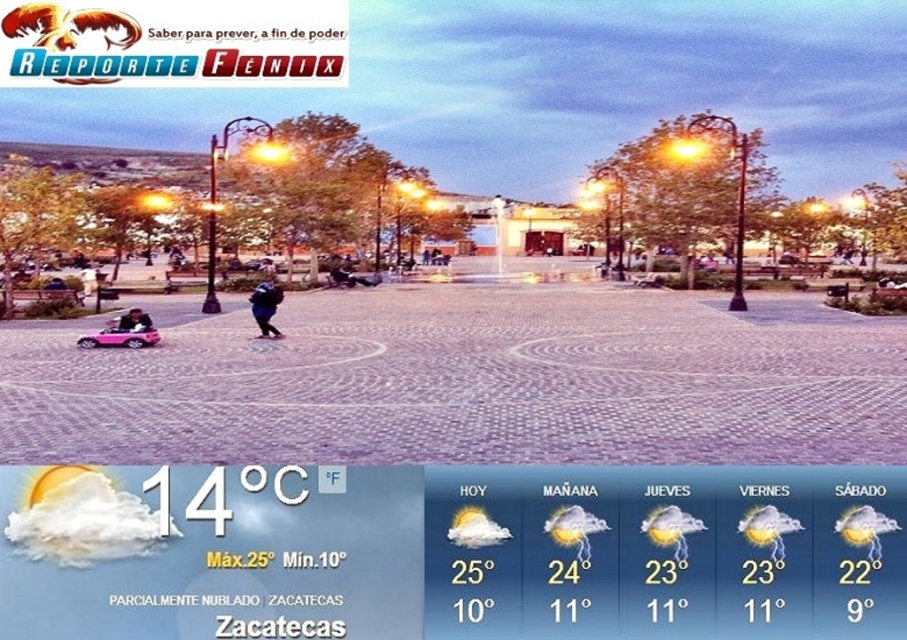
Does dark blue fabric jacket at center appear on the right side of matte pink car at lower left?

Yes, dark blue fabric jacket at center is to the right of matte pink car at lower left.

Measure the distance between dark blue fabric jacket at center and matte pink car at lower left.

dark blue fabric jacket at center is 5.20 meters away from matte pink car at lower left.

Where is `dark blue fabric jacket at center`? This screenshot has width=907, height=640. dark blue fabric jacket at center is located at coordinates (265, 305).